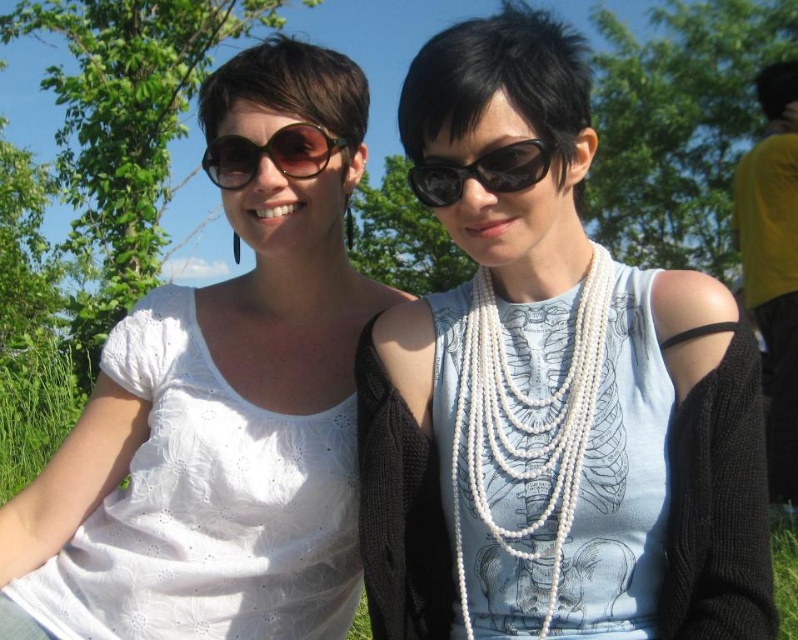
Question: Is white lace blouse at upper left smaller than black plastic goggles at center?

Choices:
 (A) no
 (B) yes

Answer: (A)

Question: Observing the image, what is the correct spatial positioning of pearl necklace at center in reference to white lace blouse at upper left?

Choices:
 (A) left
 (B) right

Answer: (B)

Question: Which of the following is the farthest from the observer?

Choices:
 (A) (282, 173)
 (B) (488, 280)

Answer: (A)

Question: Among these objects, which one is nearest to the camera?

Choices:
 (A) pearl necklace at center
 (B) white pearl necklace at center

Answer: (A)

Question: Which object is farther from the camera taking this photo?

Choices:
 (A) white pearl necklace at center
 (B) matte black sunglasses at upper center
 (C) pearl necklace at center
 (D) white lace blouse at upper left

Answer: (B)

Question: Is white lace blouse at upper left below white pearl necklace at center?

Choices:
 (A) no
 (B) yes

Answer: (A)